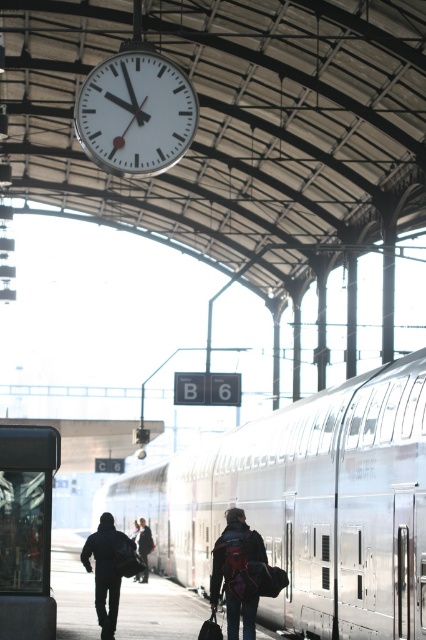
Between silver metallic train at center and matte black backpack at center, which one appears on the left side from the viewer's perspective?

silver metallic train at center

Which is behind, point (411, 534) or point (247, 595)?

Positioned behind is point (247, 595).

Is point (380, 458) farther from camera compared to point (244, 605)?

No, it is in front of (244, 605).

The width and height of the screenshot is (426, 640). Find the location of `silver metallic train at center`. silver metallic train at center is located at coordinates (307, 504).

Is white metallic clock at upper center smaller than dark blue jacket at center?

Yes.

Does point (138, 108) come behind point (109, 545)?

No.

Where is `white metallic clock at upper center`? white metallic clock at upper center is located at coordinates tap(135, 113).

Does silver metallic train at center appear on the right side of white metallic clock at upper center?

In fact, silver metallic train at center is to the left of white metallic clock at upper center.

Is silver metallic train at center taller than white metallic clock at upper center?

Yes, silver metallic train at center is taller than white metallic clock at upper center.

Is point (126, 506) in front of point (106, 144)?

No, it is behind (106, 144).

Image resolution: width=426 pixels, height=640 pixels. What are the coordinates of `silver metallic train at center` in the screenshot? It's located at (307, 504).